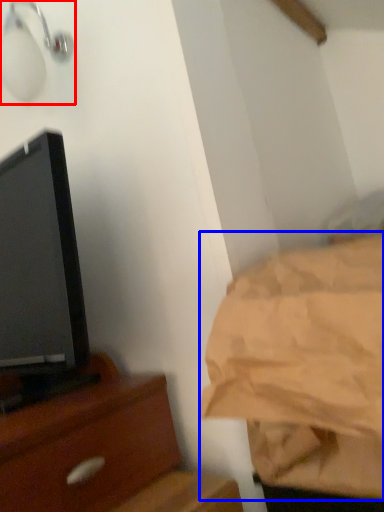
Question: Which of the following is the closest to the observer, light fixture (highlighted by a red box) or sheet (highlighted by a blue box)?

Choices:
 (A) light fixture
 (B) sheet

Answer: (B)